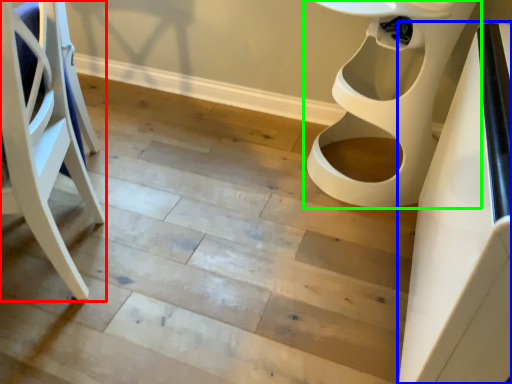
Question: Based on their relative distances, which object is nearer to furniture (highlighted by a red box)? Choose from table (highlighted by a blue box) and toilet (highlighted by a green box).

Choices:
 (A) table
 (B) toilet

Answer: (A)